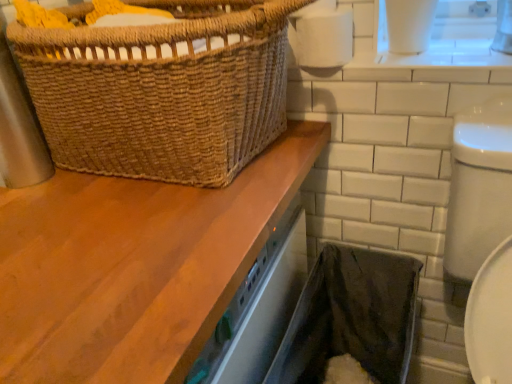
Identify the location of free space in front of brown woven basket at upper left. The width and height of the screenshot is (512, 384). (121, 256).